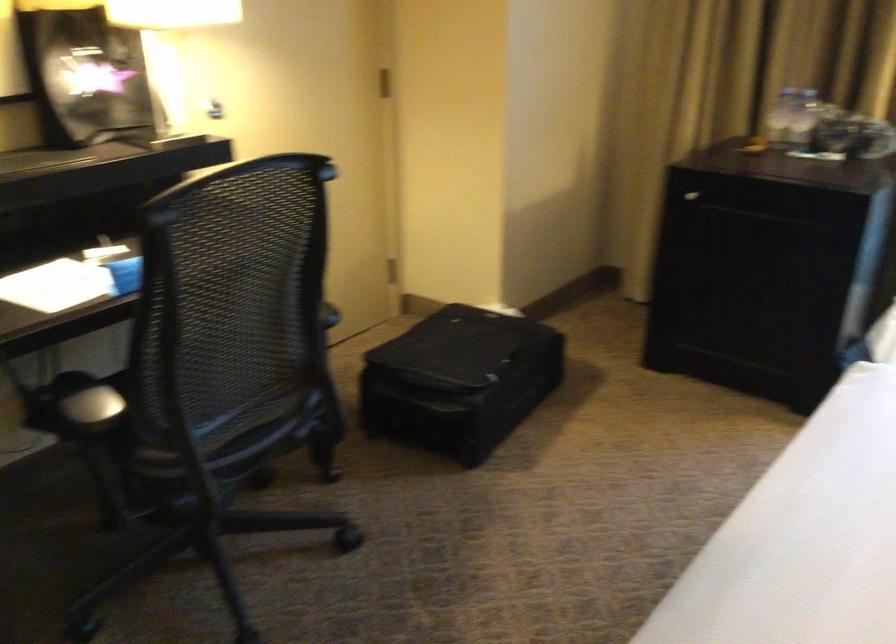
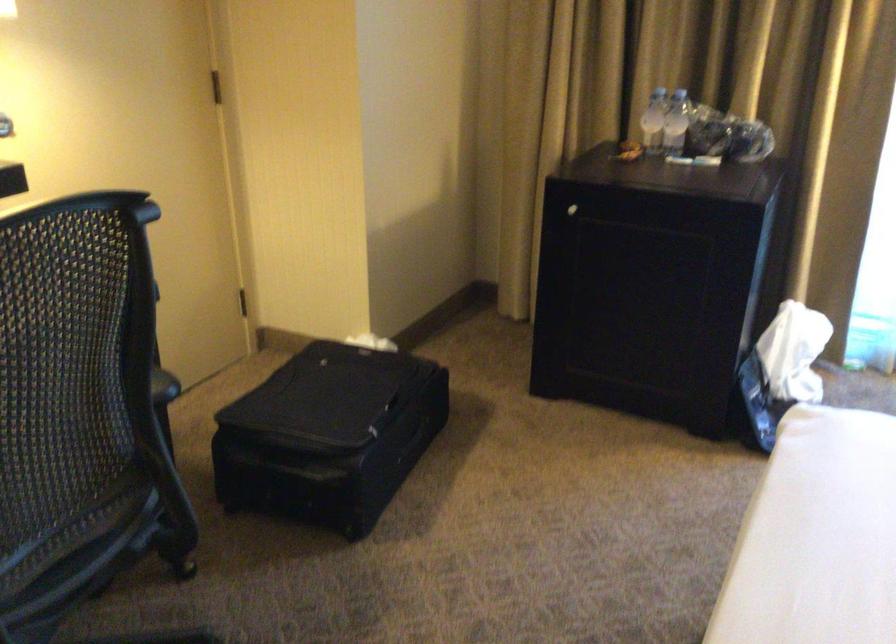
Locate, in the second image, the point that corresponds to the point at 454,377 in the first image.

(329, 436)